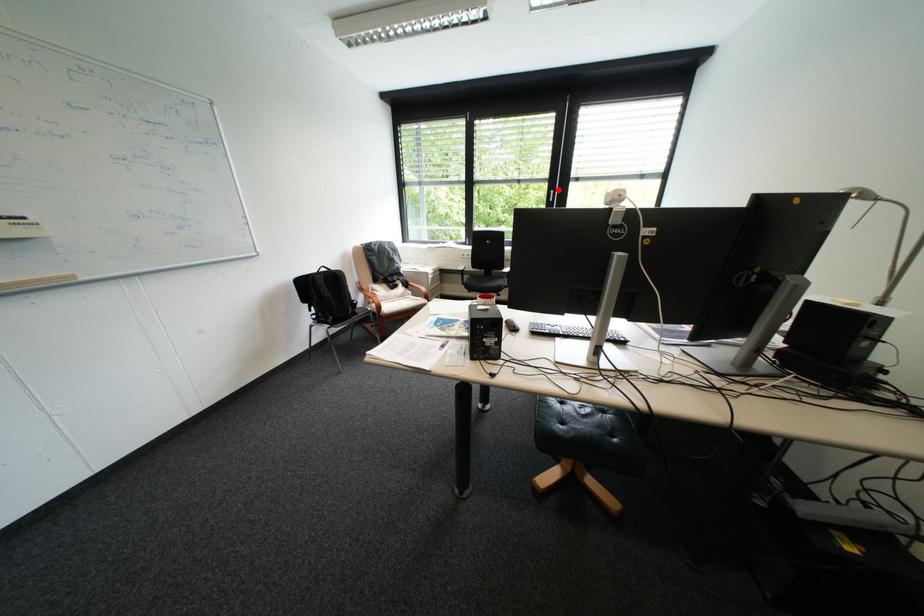
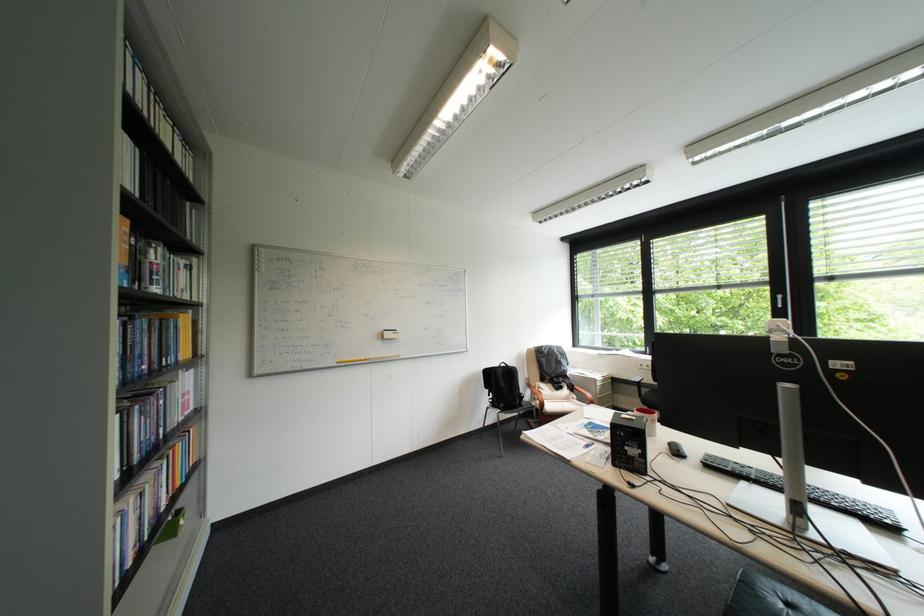
Find the pixel in the second image that matches the highlighted location in the first image.

(781, 294)